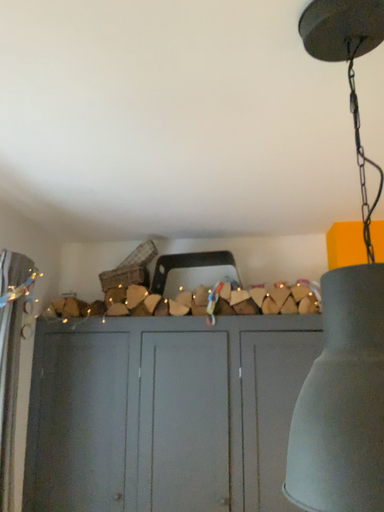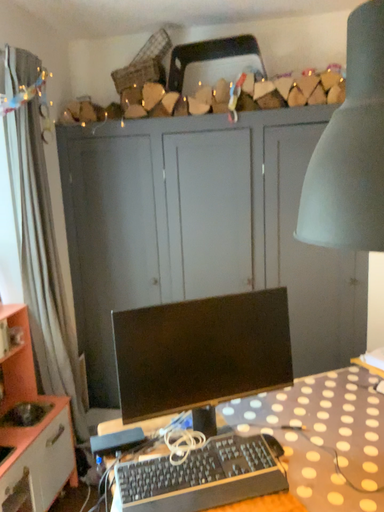
Question: How did the camera likely rotate when shooting the video?

Choices:
 (A) rotated upward
 (B) rotated downward

Answer: (B)